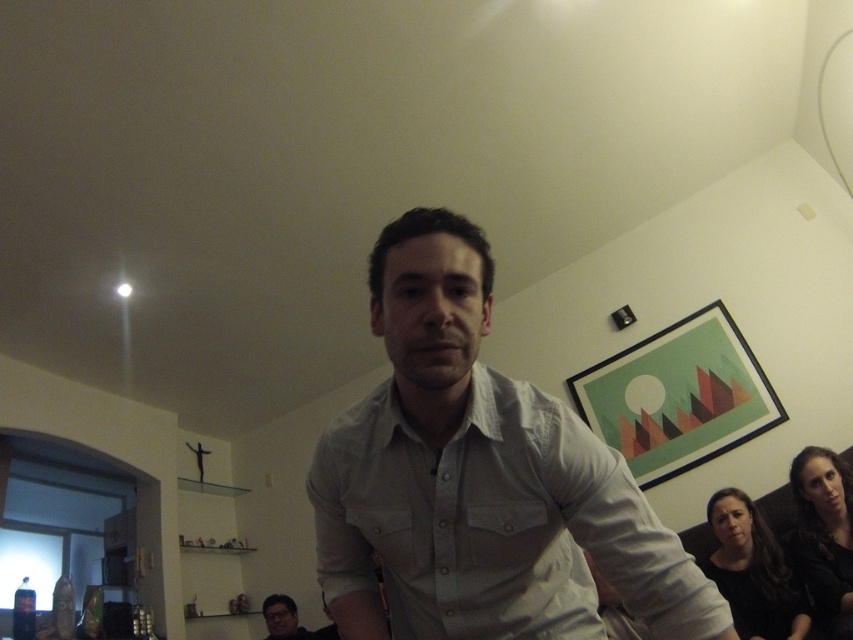
Can you confirm if white cotton shirt at center is positioned to the left of matte gray shirt at center?

In fact, white cotton shirt at center is to the right of matte gray shirt at center.

At what (x,y) coordinates should I click in order to perform the action: click on white cotton shirt at center. Please return your answer as a coordinate pair (x, y). Looking at the image, I should click on (479, 480).